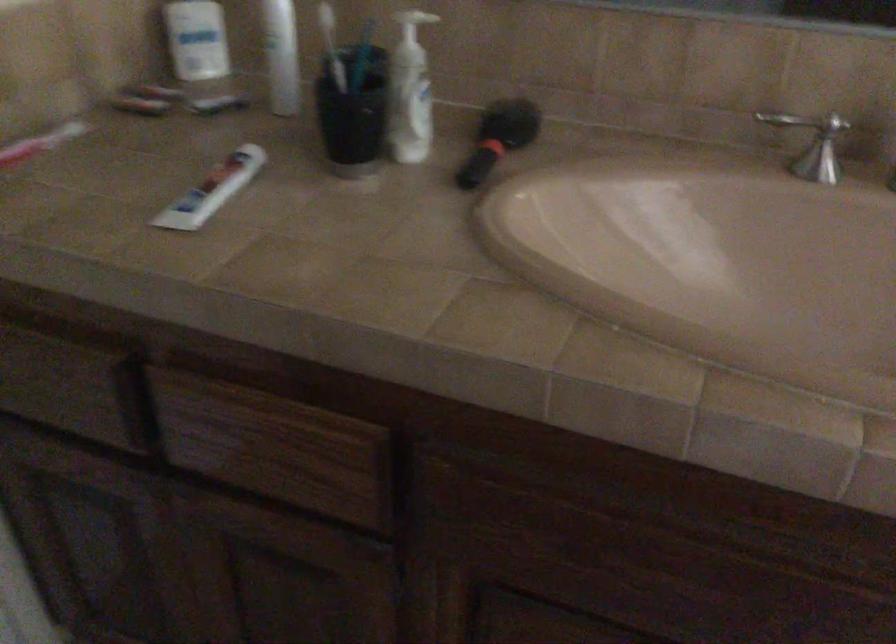
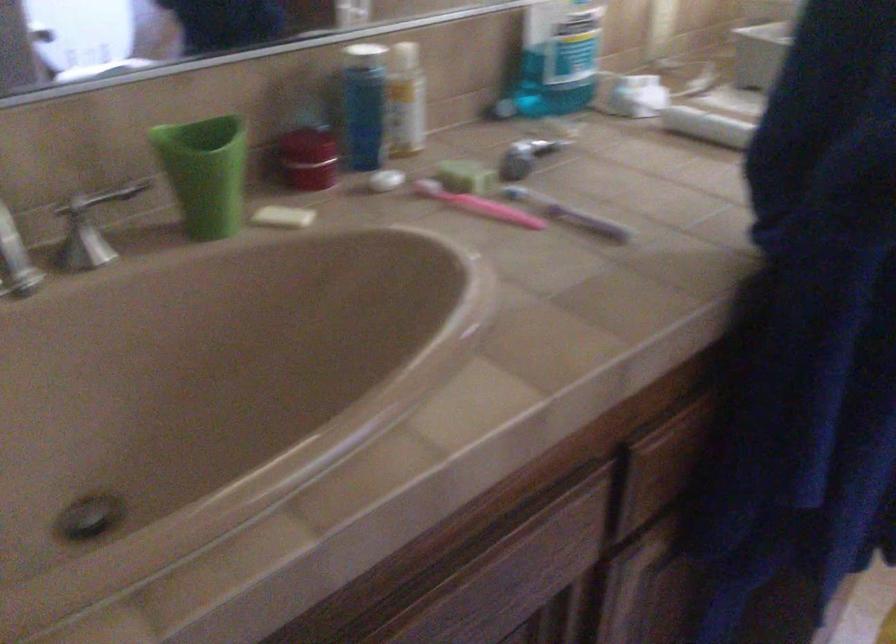
Question: The camera is either moving clockwise (left) or counter-clockwise (right) around the object. The first image is from the beginning of the video and the second image is from the end. Is the camera moving left or right when shooting the video?

Choices:
 (A) Left
 (B) Right

Answer: (A)